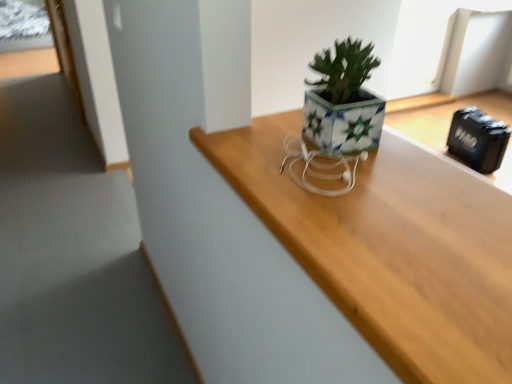
The width and height of the screenshot is (512, 384). I want to click on vacant space situated above wooden table at center (from a real-world perspective), so click(379, 184).